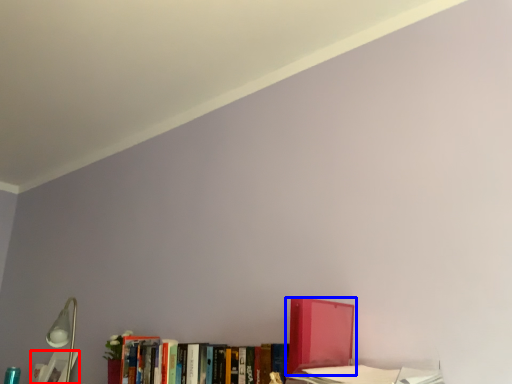
Question: Among these objects, which one is nearest to the camera, book (highlighted by a red box) or book (highlighted by a blue box)?

Choices:
 (A) book
 (B) book

Answer: (B)